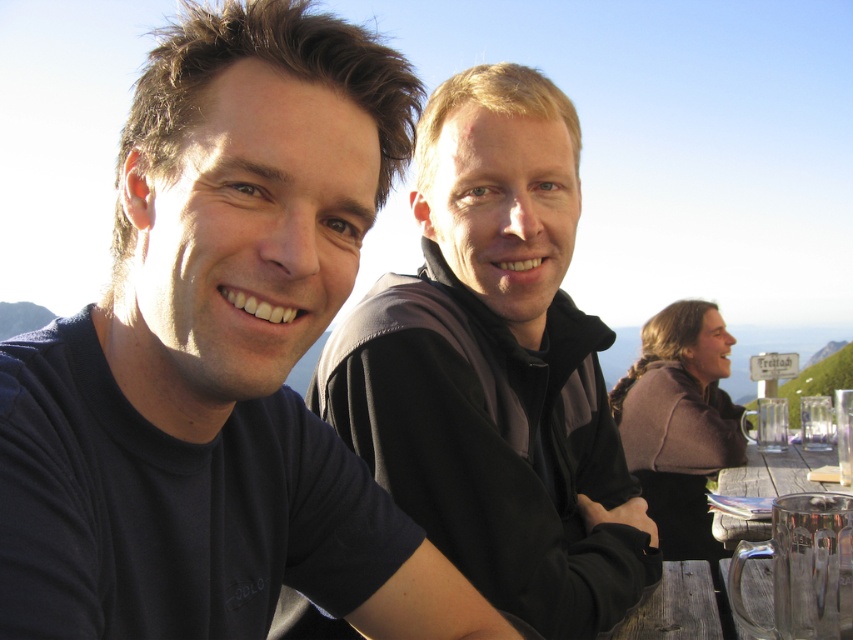
You are standing at the center of the image and want to reach the clear glass mug at lower right. Which direction should you move to get to it?

The clear glass mug at lower right is located at point (804, 568), so you should move towards the lower right direction to reach it.